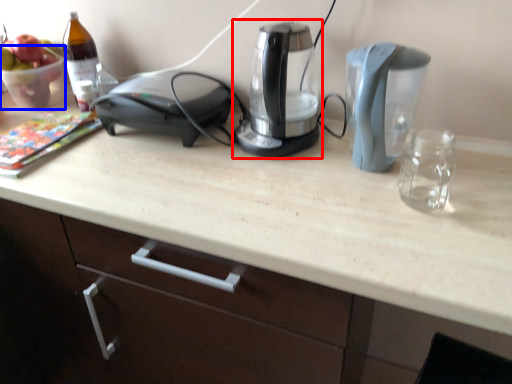
Question: Which object appears farthest to the camera in this image, kitchen appliance (highlighted by a red box) or glass bowl (highlighted by a blue box)?

Choices:
 (A) kitchen appliance
 (B) glass bowl

Answer: (B)